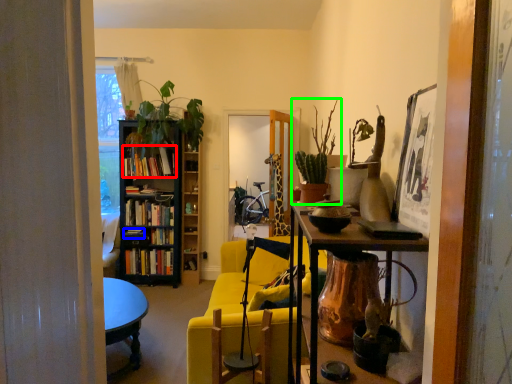
Question: Based on their relative distances, which object is farther from book (highlighted by a red box)? Choose from book (highlighted by a blue box) and houseplant (highlighted by a green box).

Choices:
 (A) book
 (B) houseplant

Answer: (B)